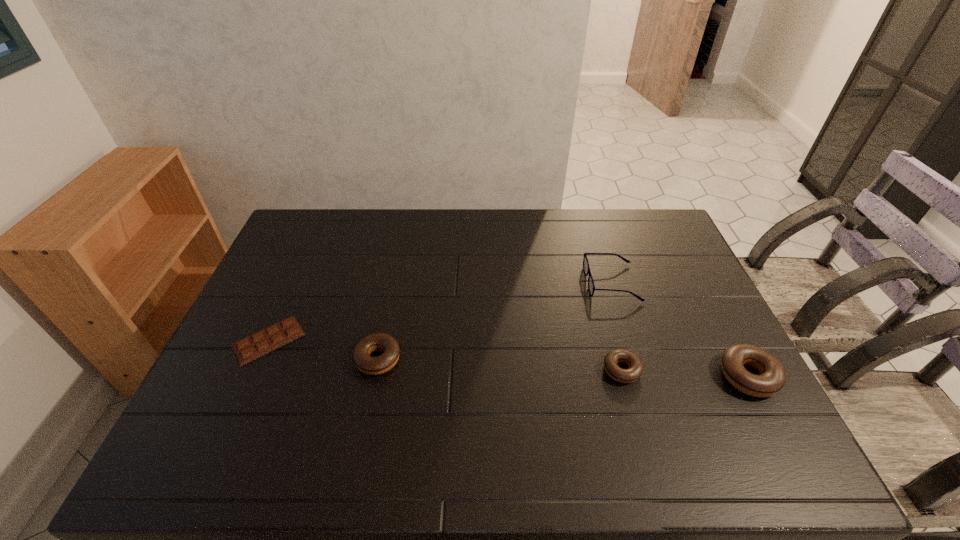
Image resolution: width=960 pixels, height=540 pixels. I want to click on free spot located 0.390m on the back of the second shortest object, so click(x=591, y=261).

Where is `free space located on the back of the rightmost doughnut`? This screenshot has width=960, height=540. free space located on the back of the rightmost doughnut is located at coordinates (699, 282).

I want to click on free region located 0.260m on the right of the shortest object, so click(396, 340).

Locate an element on the screen. free location located 0.070m on the front-facing side of the farthest object is located at coordinates (564, 282).

Where is `free location located 0.280m on the front-facing side of the farthest object`? free location located 0.280m on the front-facing side of the farthest object is located at coordinates (498, 282).

In order to click on vacant space located on the front-facing side of the farthest object in this screenshot , I will do `click(492, 282)`.

Find the location of `object situated at the near edge`. object situated at the near edge is located at coordinates (772, 378).

Locate an element on the screen. The width and height of the screenshot is (960, 540). object positioned at the left edge is located at coordinates (277, 335).

Where is `object that is at the right edge`? This screenshot has height=540, width=960. object that is at the right edge is located at coordinates (772, 378).

I want to click on object at the near right corner, so click(772, 378).